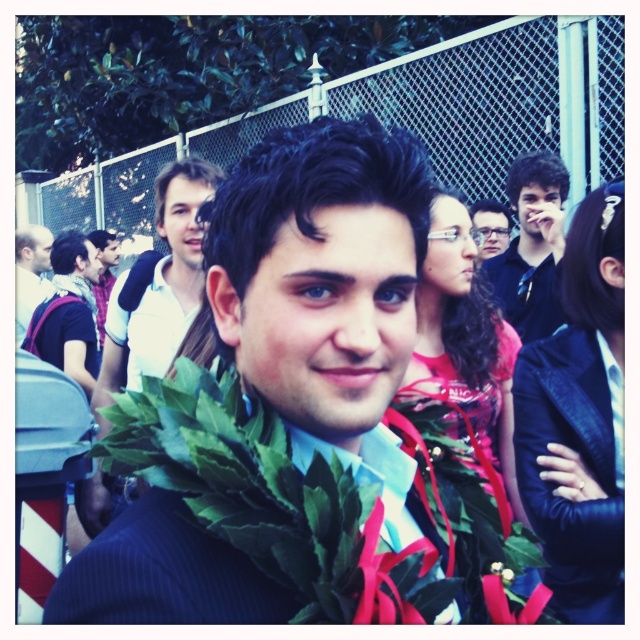
You are a photographer at the event and want to take a photo focusing on the white shirt at upper left and the matte black glasses at upper center. Which object should you adjust your camera focus on first to ensure both are in focus?

Since the white shirt at upper left is closer to the viewer than matte black glasses at upper center, you should focus on the white shirt at upper left first to ensure both are in focus.

You are a photographer at the event and want to capture both the white shirt at upper left and the matte black glasses at upper center in a single frame. Which object should you focus on first to ensure both are in the frame?

You should focus on the white shirt at upper left first because it is larger and will require more space in the frame compared to the matte black glasses at upper center.

You are a photographer at the event and want to capture both the dark blue shirt at upper right and the matte white shirt at center in a single shot. Which person should you focus on first to ensure both are in frame?

You should focus on the matte white shirt at center first because the dark blue shirt at upper right is shorter in height, so adjusting the camera angle to include the taller matte white shirt at center will naturally include the shorter dark blue shirt at upper right.